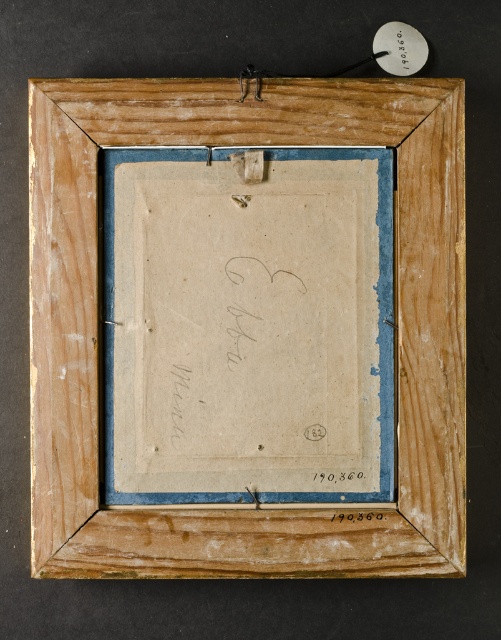
Question: Among these objects, which one is farthest from the camera?

Choices:
 (A) wooden picture frame at center
 (B) black ink signature at center

Answer: (B)

Question: Which of the following is the farthest from the observer?

Choices:
 (A) wooden picture frame at center
 (B) black ink signature at center

Answer: (B)

Question: Is wooden picture frame at center smaller than black ink signature at center?

Choices:
 (A) no
 (B) yes

Answer: (A)

Question: Observing the image, what is the correct spatial positioning of wooden picture frame at center in reference to black ink signature at center?

Choices:
 (A) left
 (B) right

Answer: (A)

Question: Does wooden picture frame at center have a smaller size compared to black ink signature at center?

Choices:
 (A) no
 (B) yes

Answer: (A)